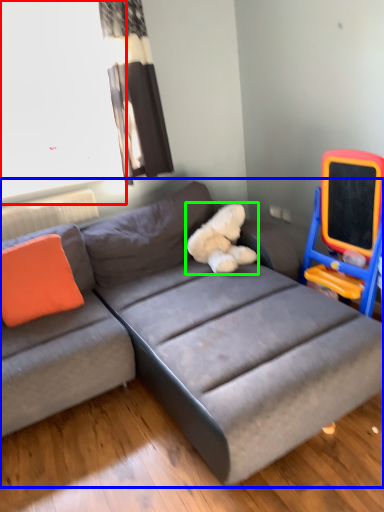
Question: Considering the real-world distances, which object is farthest from window screen (highlighted by a red box)? studio couch (highlighted by a blue box) or teddy (highlighted by a green box)?

Choices:
 (A) studio couch
 (B) teddy

Answer: (B)